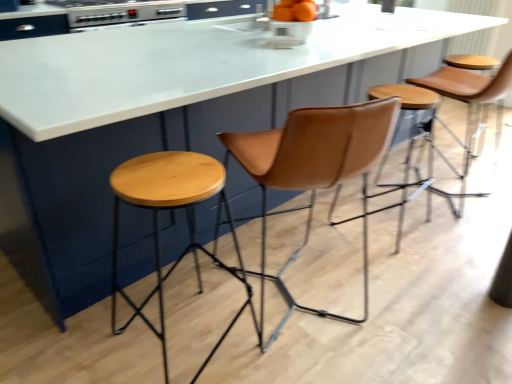
Find the location of `free spot in front of leather stool at center, the second stool from the front`. free spot in front of leather stool at center, the second stool from the front is located at coordinates (410, 267).